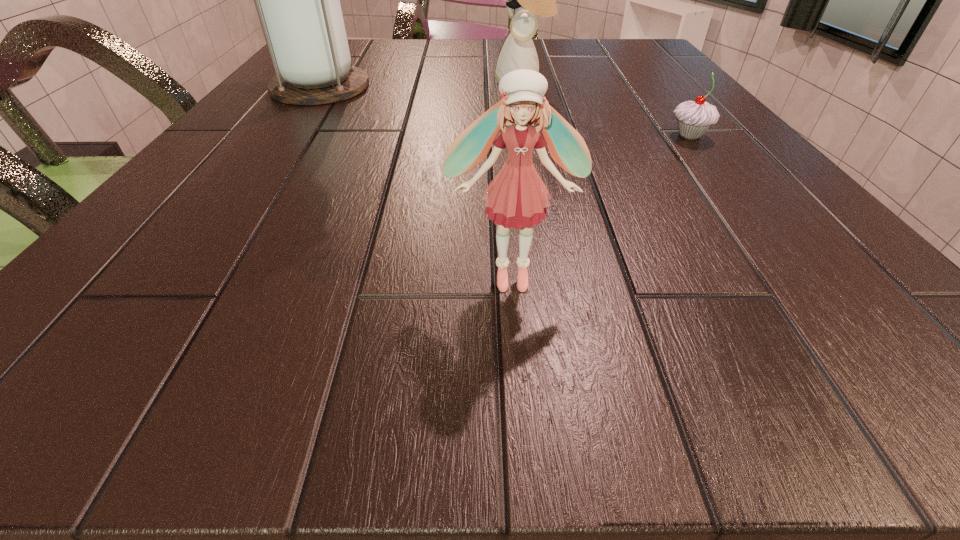
Locate an element on the screen. The image size is (960, 540). vacant space located on the front-facing side of the shorter doll is located at coordinates (517, 348).

Locate an element on the screen. vacant area situated on the back of the rightmost object is located at coordinates (661, 99).

I want to click on lantern positioned at the far edge, so click(x=298, y=2).

The width and height of the screenshot is (960, 540). Identify the location of doll positioned at the far edge. (518, 52).

Locate an element on the screen. The image size is (960, 540). object present at the left edge is located at coordinates (298, 2).

Find the location of `object positioned at the right edge`. object positioned at the right edge is located at coordinates (693, 117).

Locate an element on the screen. object situated at the far left corner is located at coordinates (298, 2).

Find the location of a particular element. free point at the far edge is located at coordinates (389, 52).

Identify the location of blank space at the near edge. This screenshot has height=540, width=960. pyautogui.click(x=299, y=334).

Find the location of a particular element. vacant position at the left edge of the desktop is located at coordinates (224, 258).